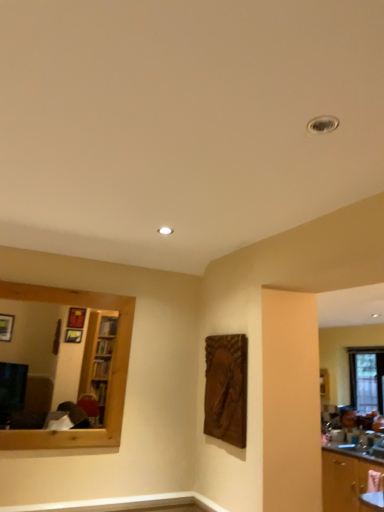
What do you see at coordinates (366, 378) in the screenshot? I see `clear glass window at right` at bounding box center [366, 378].

What do you see at coordinates (44, 346) in the screenshot? Image resolution: width=384 pixels, height=512 pixels. I see `wooden mirror at left` at bounding box center [44, 346].

What are the coordinates of `clear glass window at right` in the screenshot? It's located at (366, 378).

The height and width of the screenshot is (512, 384). What are the coordinates of `mirror on the left of the clear glass window at right` in the screenshot? It's located at (44, 346).

Which object is thinner, wooden mirror at left or clear glass window at right?

Thinner between the two is wooden mirror at left.

What's the angular difference between wooden mirror at left and clear glass window at right's facing directions?

They differ by 90.2 degrees in their facing directions.

Does wooden mirror at left touch clear glass window at right?

No, wooden mirror at left is not with clear glass window at right.

Based on the photo, is wooden cabinet at lower right with clear glass window at right?

They are not placed beside each other.

Is wooden cabinet at lower right bigger or smaller than clear glass window at right?

Clearly, wooden cabinet at lower right is larger in size than clear glass window at right.

Is wooden cabinet at lower right wider or thinner than clear glass window at right?

wooden cabinet at lower right is wider than clear glass window at right.

Which of these two, wooden cabinet at lower right or clear glass window at right, stands shorter?

clear glass window at right.

Considering the relative sizes of wooden cabinet at lower right and wooden mirror at left in the image provided, is wooden cabinet at lower right smaller than wooden mirror at left?

No.

Does wooden cabinet at lower right have a lesser width compared to wooden mirror at left?

Incorrect, the width of wooden cabinet at lower right is not less than that of wooden mirror at left.

From the image's perspective, does wooden cabinet at lower right appear lower than wooden mirror at left?

Correct, wooden cabinet at lower right appears lower than wooden mirror at left in the image.

Looking at this image, can you confirm if clear glass window at right is positioned to the left of wooden mirror at left?

Incorrect, clear glass window at right is not on the left side of wooden mirror at left.

From the image's perspective, is clear glass window at right on wooden mirror at left?

No, from the image's perspective, clear glass window at right is not above wooden mirror at left.

Is wooden mirror at left positioned beyond the bounds of wooden cabinet at lower right?

Indeed, wooden mirror at left is completely outside wooden cabinet at lower right.

This screenshot has width=384, height=512. I want to click on mirror above the wooden cabinet at lower right (from a real-world perspective), so click(x=44, y=346).

Is wooden mirror at left in contact with wooden cabinet at lower right?

No, wooden mirror at left is not in contact with wooden cabinet at lower right.

Considering the sizes of wooden mirror at left and wooden cabinet at lower right in the image, is wooden mirror at left taller or shorter than wooden cabinet at lower right?

Clearly, wooden mirror at left is shorter compared to wooden cabinet at lower right.

Between clear glass window at right and wooden cabinet at lower right, which one is positioned behind?

Positioned behind is clear glass window at right.

Locate an element on the screen. This screenshot has height=512, width=384. cabinetry lying on the left of clear glass window at right is located at coordinates (346, 477).

The width and height of the screenshot is (384, 512). I want to click on window on the right of wooden mirror at left, so click(x=366, y=378).

Locate an element on the screen. This screenshot has width=384, height=512. cabinetry lying in front of the clear glass window at right is located at coordinates (346, 477).

Consider the image. Estimate the real-world distances between objects in this image. Which object is further from wooden cabinet at lower right, wooden mirror at left or clear glass window at right?

Based on the image, wooden mirror at left appears to be further to wooden cabinet at lower right.

When comparing their distances from clear glass window at right, does wooden mirror at left or wooden cabinet at lower right seem closer?

Based on the image, wooden cabinet at lower right appears to be nearer to clear glass window at right.

Looking at the image, which one is located further to clear glass window at right, wooden cabinet at lower right or wooden mirror at left?

The object further to clear glass window at right is wooden mirror at left.

From the image, which object appears to be farther from wooden cabinet at lower right, clear glass window at right or wooden mirror at left?

wooden mirror at left is positioned further to the anchor wooden cabinet at lower right.

Looking at the image, which one is located further to wooden mirror at left, wooden cabinet at lower right or clear glass window at right?

The object further to wooden mirror at left is clear glass window at right.

Looking at the image, which one is located further to wooden mirror at left, clear glass window at right or wooden cabinet at lower right?

clear glass window at right.

Find the location of a particular element. cabinetry between wooden mirror at left and clear glass window at right from front to back is located at coordinates (346, 477).